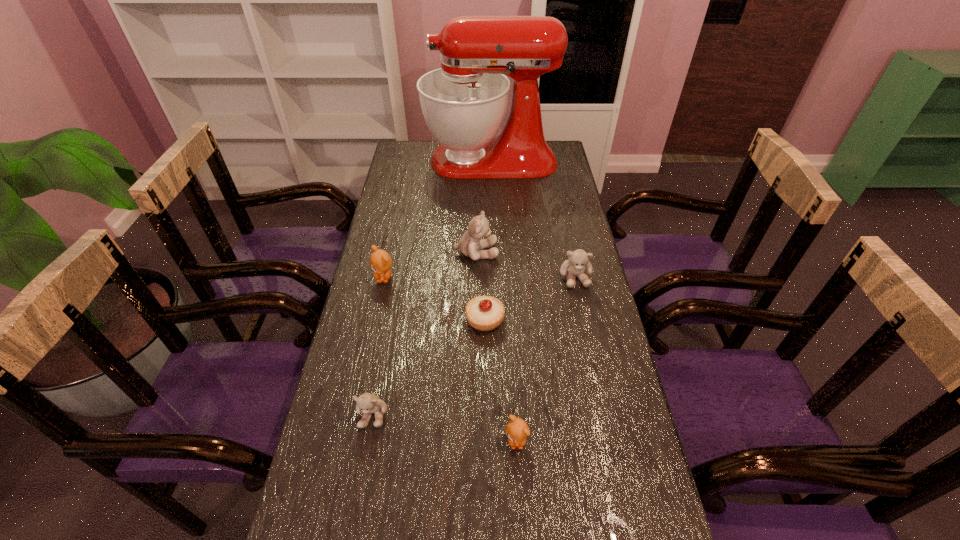
Locate an element on the screen. This screenshot has width=960, height=540. vacant space located on the back of the pastry is located at coordinates (484, 251).

Locate an element on the screen. object at the far edge is located at coordinates (464, 102).

The width and height of the screenshot is (960, 540). I want to click on mixer positioned at the left edge, so click(464, 102).

Locate an element on the screen. This screenshot has height=540, width=960. mixer present at the right edge is located at coordinates (464, 102).

This screenshot has width=960, height=540. Identify the location of teddy bear that is positioned at the right edge. (578, 262).

Identify the location of object at the far left corner. (464, 102).

Find the location of a particular element. This screenshot has width=960, height=540. object situated at the far right corner is located at coordinates (464, 102).

Locate an element on the screen. free location at the left edge is located at coordinates (330, 415).

The width and height of the screenshot is (960, 540). I want to click on vacant space at the right edge of the desktop, so click(604, 341).

Locate an element on the screen. vacant area at the far left corner is located at coordinates (416, 161).